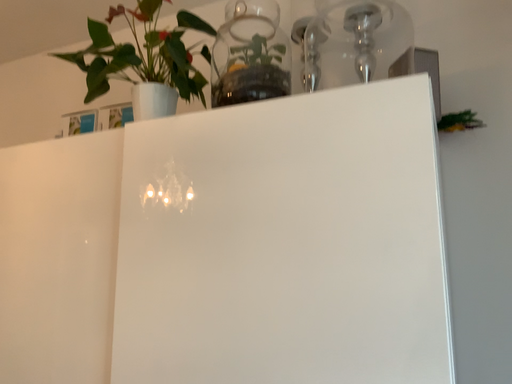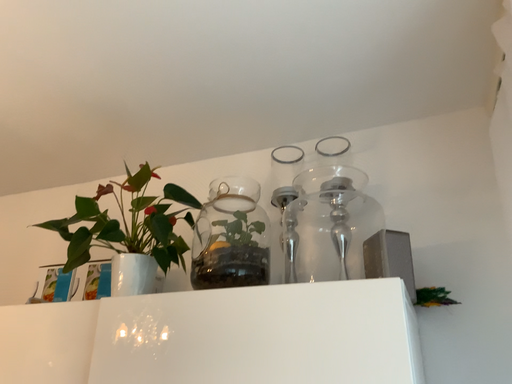
Question: How did the camera likely rotate when shooting the video?

Choices:
 (A) rotated downward
 (B) rotated upward

Answer: (B)